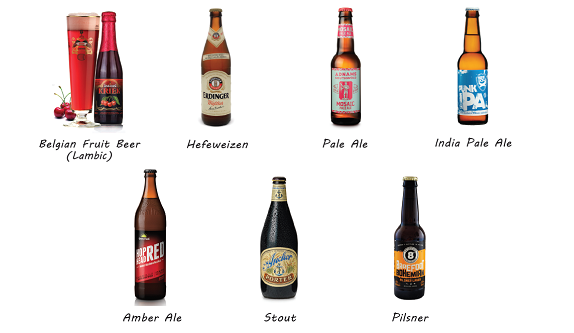
The image size is (574, 333). What are the coordinates of `beer in glass` in the screenshot? It's located at (77, 75).